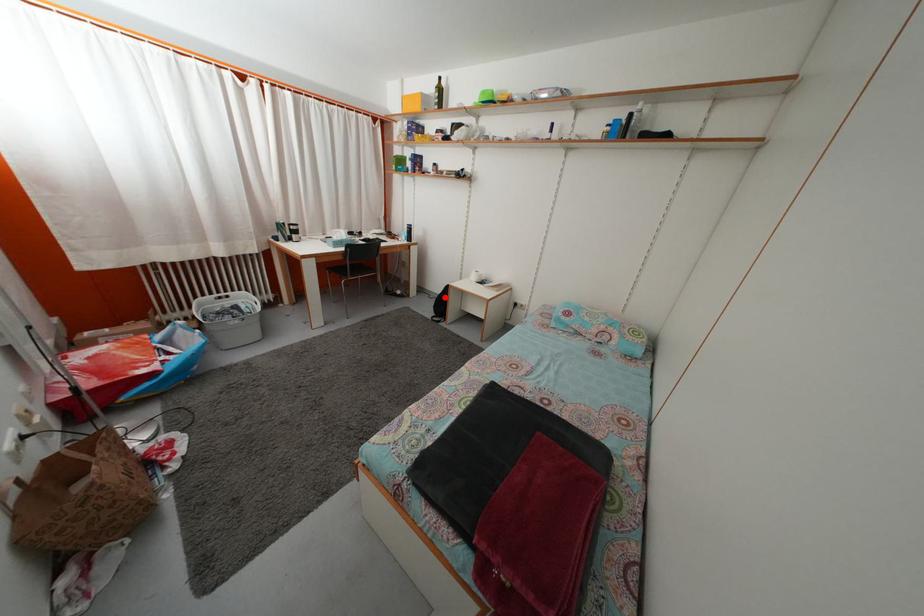
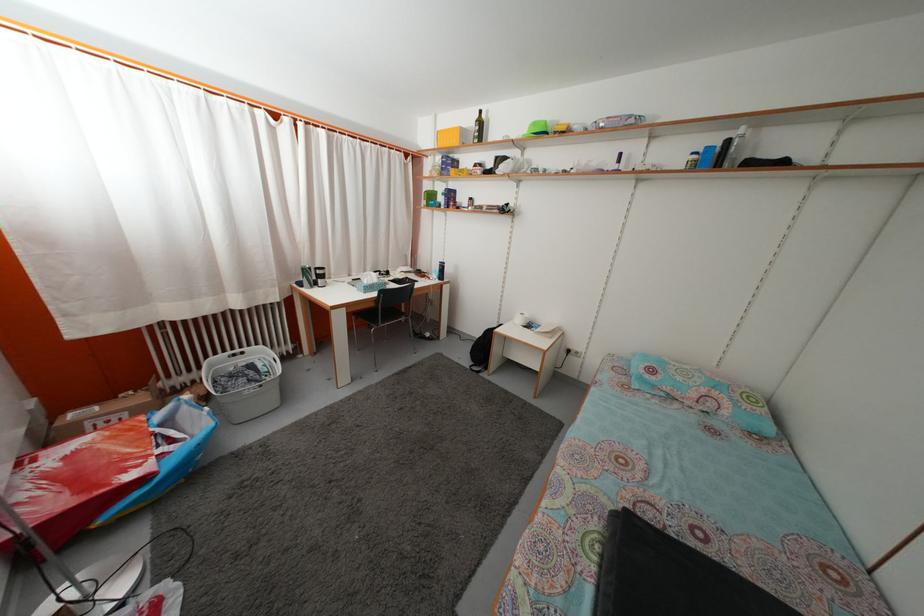
The point at the highlighted location is marked in the first image. Where is the corresponding point in the second image?

(482, 342)